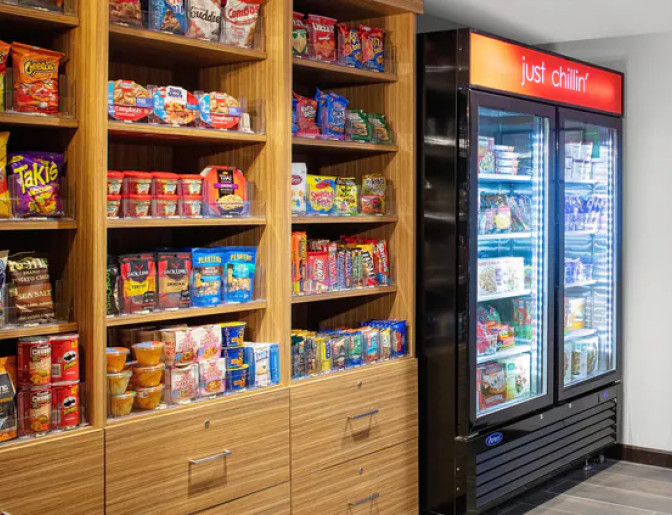
Where is `black refridgorated snack vending machine`? black refridgorated snack vending machine is located at coordinates (433, 169).